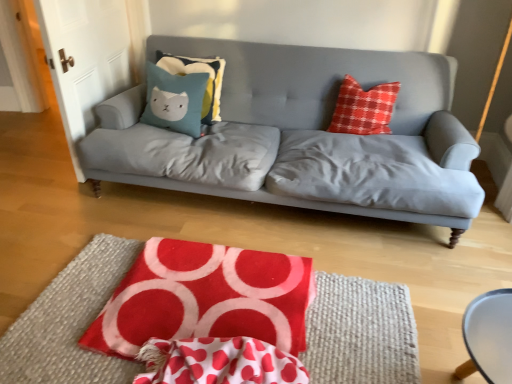
This screenshot has height=384, width=512. Identify the location of free space behind smooth white table at lower right. (442, 332).